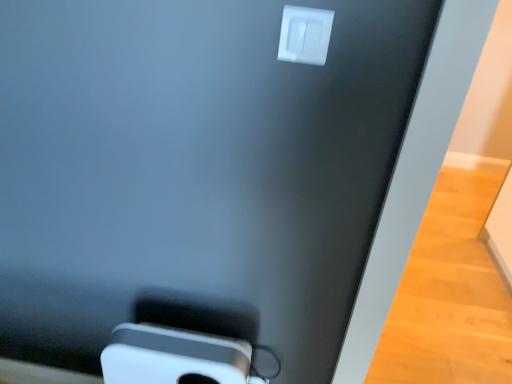
What do you see at coordinates (173, 357) in the screenshot? The height and width of the screenshot is (384, 512). I see `white plastic ipod at lower center` at bounding box center [173, 357].

Find the location of a particular element. The width and height of the screenshot is (512, 384). white plastic ipod at lower center is located at coordinates (173, 357).

The width and height of the screenshot is (512, 384). In order to click on white plastic power plugs and sockets at upper center in this screenshot , I will do `click(305, 35)`.

The width and height of the screenshot is (512, 384). What do you see at coordinates (305, 35) in the screenshot?
I see `white plastic power plugs and sockets at upper center` at bounding box center [305, 35].

Locate an element on the screen. The image size is (512, 384). white plastic ipod at lower center is located at coordinates (173, 357).

Considering the positions of objects white plastic power plugs and sockets at upper center and white plastic ipod at lower center in the image provided, who is more to the left, white plastic power plugs and sockets at upper center or white plastic ipod at lower center?

white plastic ipod at lower center is more to the left.

Considering the positions of objects white plastic power plugs and sockets at upper center and white plastic ipod at lower center in the image provided, who is in front, white plastic power plugs and sockets at upper center or white plastic ipod at lower center?

white plastic power plugs and sockets at upper center is in front.

Is point (288, 18) more distant than point (108, 363)?

No.

From the image's perspective, is white plastic power plugs and sockets at upper center positioned above or below white plastic ipod at lower center?

Clearly, from the image's perspective, white plastic power plugs and sockets at upper center is above white plastic ipod at lower center.

Based on the photo, from a real-world perspective, is white plastic power plugs and sockets at upper center above or below white plastic ipod at lower center?

white plastic power plugs and sockets at upper center is above white plastic ipod at lower center.

Which of these two, white plastic power plugs and sockets at upper center or white plastic ipod at lower center, is thinner?

With smaller width is white plastic power plugs and sockets at upper center.

Considering the sizes of white plastic power plugs and sockets at upper center and white plastic ipod at lower center in the image, is white plastic power plugs and sockets at upper center taller or shorter than white plastic ipod at lower center?

In the image, white plastic power plugs and sockets at upper center appears to be shorter than white plastic ipod at lower center.

Does white plastic power plugs and sockets at upper center have a smaller size compared to white plastic ipod at lower center?

Indeed, white plastic power plugs and sockets at upper center has a smaller size compared to white plastic ipod at lower center.

Is white plastic power plugs and sockets at upper center located outside white plastic ipod at lower center?

Yes, white plastic power plugs and sockets at upper center is not within white plastic ipod at lower center.

Is the surface of white plastic power plugs and sockets at upper center in direct contact with white plastic ipod at lower center?

No, white plastic power plugs and sockets at upper center is not in contact with white plastic ipod at lower center.

Is white plastic power plugs and sockets at upper center oriented away from white plastic ipod at lower center?

No, white plastic power plugs and sockets at upper center's orientation is not away from white plastic ipod at lower center.

What's the angular difference between white plastic power plugs and sockets at upper center and white plastic ipod at lower center's facing directions?

0.352 degrees.

Image resolution: width=512 pixels, height=384 pixels. What are the coordinates of `ipod that is under the white plastic power plugs and sockets at upper center (from a real-world perspective)` in the screenshot? It's located at (173, 357).

Based on their positions, is white plastic ipod at lower center located to the left or right of white plastic power plugs and sockets at upper center?

In the image, white plastic ipod at lower center appears on the left side of white plastic power plugs and sockets at upper center.

Is the position of white plastic ipod at lower center less distant than that of white plastic power plugs and sockets at upper center?

No, it is behind white plastic power plugs and sockets at upper center.

Which is in front, point (199, 355) or point (295, 10)?

The point (295, 10) is closer.

From the image's perspective, is white plastic ipod at lower center located beneath white plastic power plugs and sockets at upper center?

Yes, from the image's perspective, white plastic ipod at lower center is below white plastic power plugs and sockets at upper center.

From a real-world perspective, which object stands above the other?

white plastic power plugs and sockets at upper center is physically above.

Does white plastic ipod at lower center have a greater width compared to white plastic power plugs and sockets at upper center?

Indeed, white plastic ipod at lower center has a greater width compared to white plastic power plugs and sockets at upper center.

Is white plastic ipod at lower center taller than white plastic power plugs and sockets at upper center?

Indeed, white plastic ipod at lower center has a greater height compared to white plastic power plugs and sockets at upper center.

Does white plastic ipod at lower center have a larger size compared to white plastic power plugs and sockets at upper center?

Correct, white plastic ipod at lower center is larger in size than white plastic power plugs and sockets at upper center.

Is white plastic ipod at lower center completely or partially outside of white plastic power plugs and sockets at upper center?

Absolutely, white plastic ipod at lower center is external to white plastic power plugs and sockets at upper center.

Is white plastic ipod at lower center far from white plastic power plugs and sockets at upper center?

Actually, white plastic ipod at lower center and white plastic power plugs and sockets at upper center are a little close together.

Is white plastic ipod at lower center facing away from white plastic power plugs and sockets at upper center?

No, white plastic power plugs and sockets at upper center is not at the back of white plastic ipod at lower center.

Identify the location of ipod on the left of white plastic power plugs and sockets at upper center. (x=173, y=357).

What are the coordinates of `power plugs and sockets that is above the white plastic ipod at lower center (from a real-world perspective)` in the screenshot? It's located at (305, 35).

This screenshot has height=384, width=512. In order to click on power plugs and sockets in front of the white plastic ipod at lower center in this screenshot , I will do `click(305, 35)`.